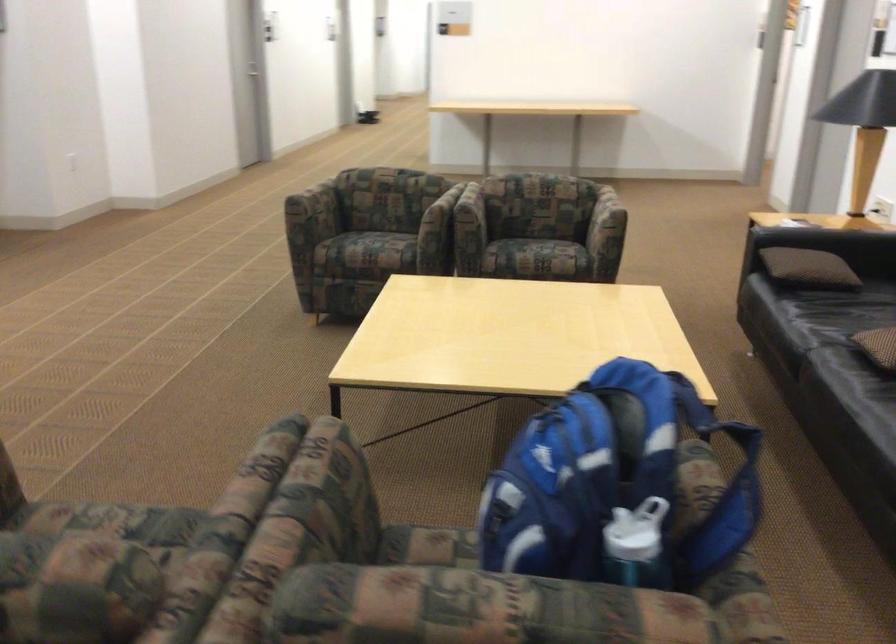
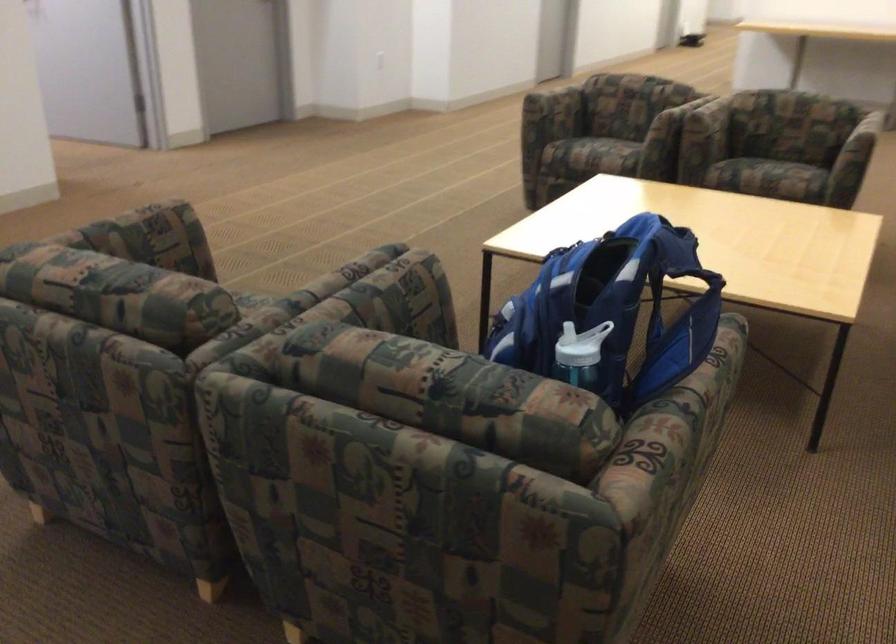
Find the pixel in the second image that matches [655,486] in the first image.

(613, 310)